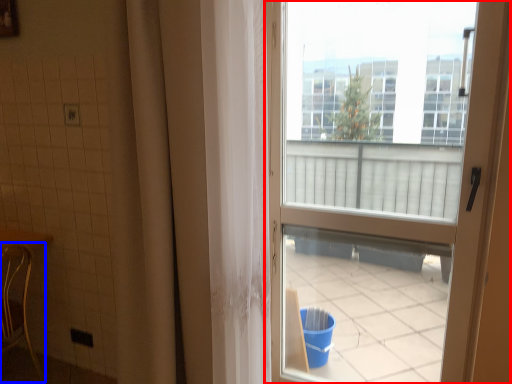
Question: Which object appears farthest to the camera in this image, door (highlighted by a red box) or chair (highlighted by a blue box)?

Choices:
 (A) door
 (B) chair

Answer: (B)